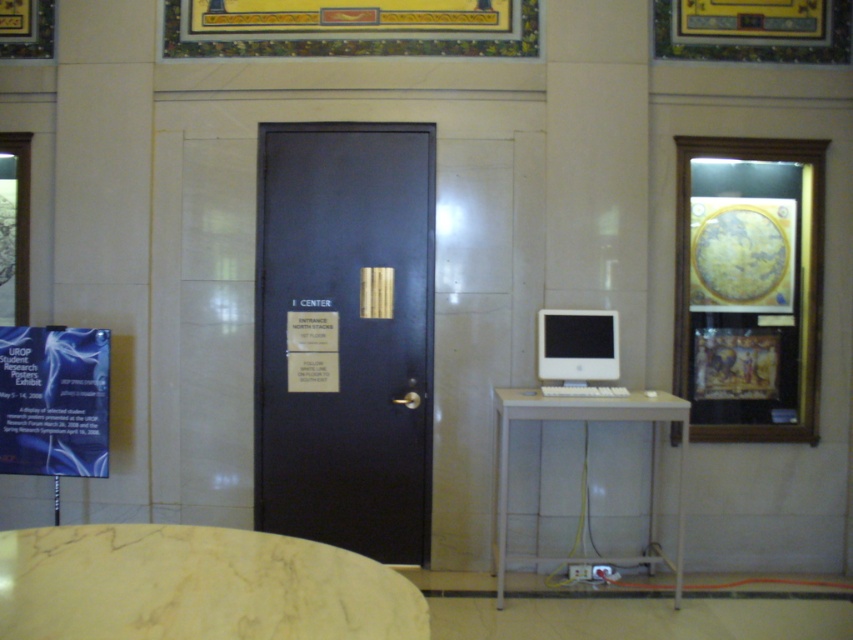
Question: Among these points, which one is farthest from the camera?

Choices:
 (A) (643, 552)
 (B) (390, 177)

Answer: (A)

Question: Which point appears closest to the camera in this image?

Choices:
 (A) (309, 605)
 (B) (288, 326)
 (C) (670, 396)
 (D) (602, 371)

Answer: (A)

Question: Is matte black door at center bigger than marble table at lower left?

Choices:
 (A) no
 (B) yes

Answer: (B)

Question: Which of the following is the closest to the observer?

Choices:
 (A) (578, 412)
 (B) (602, 320)
 (C) (49, 627)
 (D) (270, 241)

Answer: (C)

Question: Is marble table at lower left smaller than white glossy table at center?

Choices:
 (A) yes
 (B) no

Answer: (A)

Question: Where is marble table at lower left located in relation to white glossy table at center in the image?

Choices:
 (A) above
 (B) below

Answer: (A)